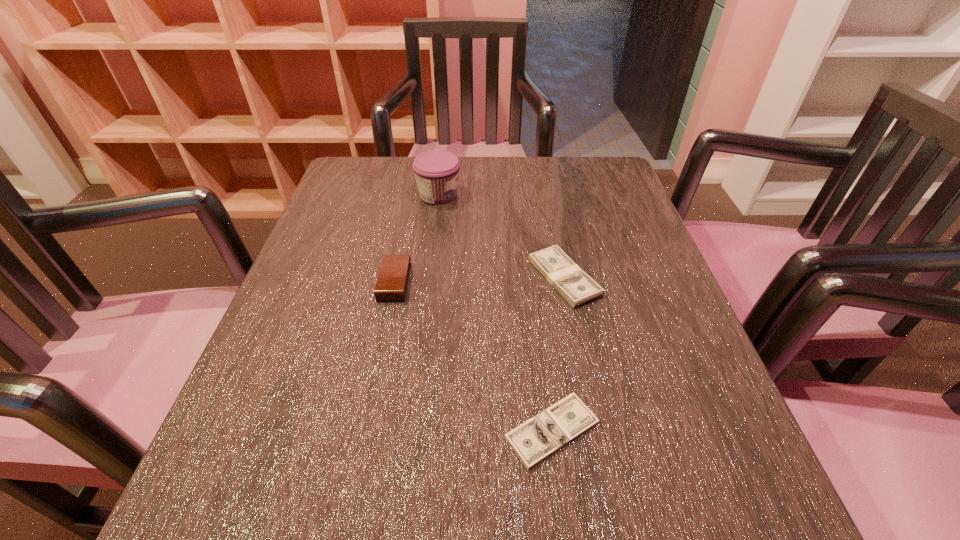
This screenshot has width=960, height=540. Identify the location of free space located on the left of the nearer dollar. (435, 430).

The image size is (960, 540). I want to click on object that is at the far edge, so click(437, 172).

You are a GUI agent. You are given a task and a screenshot of the screen. Output one action in this format:
    pyautogui.click(x=<x>, y=<y>)
    Task: Click on the object that is at the right edge
    Image resolution: width=960 pixels, height=540 pixels.
    Given the screenshot: What is the action you would take?
    pyautogui.click(x=574, y=285)

What are the coordinates of `vacant space at the far edge of the desktop` in the screenshot? It's located at point(554,195).

You are a GUI agent. You are given a task and a screenshot of the screen. Output one action in this format:
    pyautogui.click(x=<x>, y=<y>)
    Task: Click on the blank space at the near edge
    
    Given the screenshot: What is the action you would take?
    pyautogui.click(x=496, y=537)

I want to click on vacant space at the left edge of the desktop, so click(368, 254).

In the image, there is a desktop. Find the location of `free space at the right edge`. free space at the right edge is located at coordinates (639, 357).

Find the location of a particular element. free location at the far left corner is located at coordinates (339, 202).

Find the location of `vacant space at the far right corner`. vacant space at the far right corner is located at coordinates [611, 196].

Identify the location of vacant space at the near right corner of the desktop. This screenshot has width=960, height=540. (746, 539).